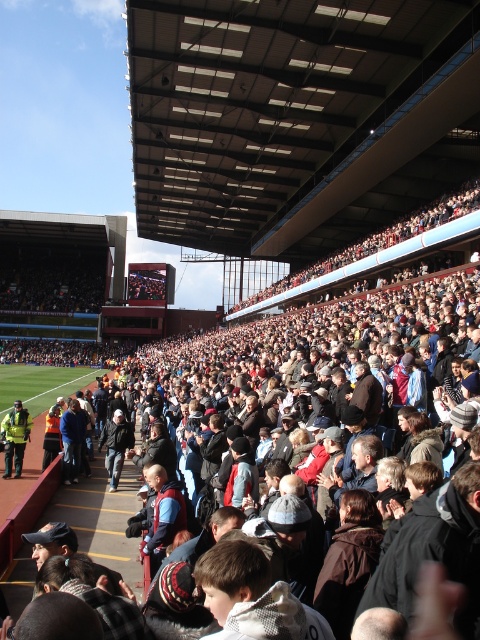
You are a photographer at the stadium and want to capture a photo of the dark brown leather jacket at center. The stadium has a large open roof with horizontal panels. To avoid casting shadows on the jacket, where should you position yourself relative to the sun? Please provide coordinates in the format of x,y. The sun is currently at the position of 0.2,0.3 in the image coordinate system.

To avoid casting shadows on the dark brown leather jacket at center located at point (322, 360), you should position yourself on the opposite side of the sun. Since the sun is at (144, 128), you should stand at coordinates (479, 593). This position ensures that your shadow falls away from the jacket, keeping it well lit and shadow free.